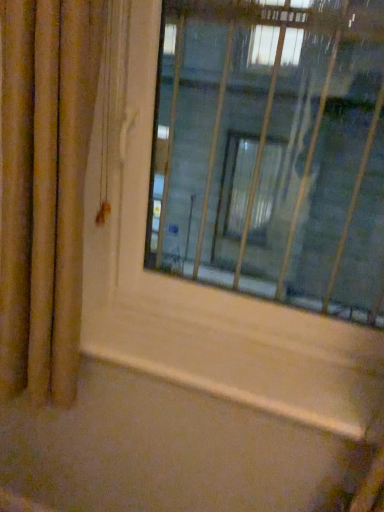
From the picture: Measure the distance between transparent glass window at center and camera.

transparent glass window at center and camera are 38.70 inches apart.

What do you see at coordinates (45, 189) in the screenshot? I see `gold textured curtain at left` at bounding box center [45, 189].

Image resolution: width=384 pixels, height=512 pixels. In order to click on transparent glass window at center in this screenshot , I will do `click(272, 151)`.

From the picture: Could you tell me if gold textured curtain at left is facing transparent glass window at center?

No, gold textured curtain at left is not oriented towards transparent glass window at center.

Is the position of gold textured curtain at left more distant than that of transparent glass window at center?

No, gold textured curtain at left is in front of transparent glass window at center.

Is gold textured curtain at left in contact with transparent glass window at center?

They are not placed beside each other.

Is gold textured curtain at left inside the boundaries of transparent glass window at center, or outside?

gold textured curtain at left is located beyond the bounds of transparent glass window at center.

Is transparent glass window at center to the left or to the right of wooden at lower center in the image?

Based on their positions, transparent glass window at center is located to the right of wooden at lower center.

Which of these two, transparent glass window at center or wooden at lower center, is wider?

With larger width is wooden at lower center.

Identify the location of window sill that is under the transparent glass window at center (from a real-world perspective). (234, 394).

Is transparent glass window at center positioned far away from wooden at lower center?

Actually, transparent glass window at center and wooden at lower center are a little close together.

In the scene shown: Is the position of transparent glass window at center more distant than that of gold textured curtain at left?

Yes, it is behind gold textured curtain at left.

How distant is transparent glass window at center from gold textured curtain at left?

They are 20.24 inches apart.

From the picture: Can you confirm if transparent glass window at center is shorter than gold textured curtain at left?

Indeed, transparent glass window at center has a lesser height compared to gold textured curtain at left.

Which is correct: transparent glass window at center is inside gold textured curtain at left, or outside of it?

transparent glass window at center cannot be found inside gold textured curtain at left.

From the image's perspective, does wooden at lower center appear lower than gold textured curtain at left?

Yes.

Considering the positions of points (361, 437) and (78, 159), is point (361, 437) closer to camera compared to point (78, 159)?

No, (361, 437) is behind (78, 159).

You are a GUI agent. You are given a task and a screenshot of the screen. Output one action in this format:
    pyautogui.click(x=<x>, y=<y>)
    Task: Click on the window sill directly beneath the gold textured curtain at left (from a real-world perspective)
    The height and width of the screenshot is (512, 384).
    Given the screenshot: What is the action you would take?
    pyautogui.click(x=234, y=394)

From a real-world perspective, who is located lower, wooden at lower center or gold textured curtain at left?

wooden at lower center is physically lower.

Can you confirm if wooden at lower center is positioned to the right of transparent glass window at center?

Incorrect, wooden at lower center is not on the right side of transparent glass window at center.

Looking at this image, how far apart are wooden at lower center and transparent glass window at center?

wooden at lower center is 23.08 inches away from transparent glass window at center.

From a real-world perspective, is wooden at lower center positioned over transparent glass window at center based on gravity?

Actually, wooden at lower center is physically below transparent glass window at center in the real world.

Which is in front, point (245, 390) or point (298, 252)?

The point (245, 390) is closer to the camera.

Is there a large distance between gold textured curtain at left and wooden at lower center?

No.

Considering the sizes of objects gold textured curtain at left and wooden at lower center in the image provided, who is bigger, gold textured curtain at left or wooden at lower center?

With larger size is gold textured curtain at left.

In the scene shown: Is gold textured curtain at left not within wooden at lower center?

That's correct, gold textured curtain at left is outside of wooden at lower center.

In the scene shown: Considering the sizes of gold textured curtain at left and wooden at lower center in the image, is gold textured curtain at left taller or shorter than wooden at lower center?

In the image, gold textured curtain at left appears to be taller than wooden at lower center.

Locate an element on the screen. window behind the gold textured curtain at left is located at coordinates (272, 151).

Identify the location of window sill on the left side of transparent glass window at center. This screenshot has width=384, height=512. (234, 394).

When comparing their distances from gold textured curtain at left, does transparent glass window at center or wooden at lower center seem closer?

The object closer to gold textured curtain at left is wooden at lower center.

Considering their positions, is gold textured curtain at left positioned further to transparent glass window at center than wooden at lower center?

wooden at lower center lies further to transparent glass window at center than the other object.

Estimate the real-world distances between objects in this image. Which object is closer to transparent glass window at center, wooden at lower center or gold textured curtain at left?

gold textured curtain at left is closer to transparent glass window at center.

Looking at this image, estimate the real-world distances between objects in this image. Which object is further from wooden at lower center, gold textured curtain at left or transparent glass window at center?

transparent glass window at center is positioned further to the anchor wooden at lower center.

Which object lies nearer to the anchor point gold textured curtain at left, wooden at lower center or transparent glass window at center?

The object closer to gold textured curtain at left is wooden at lower center.

Estimate the real-world distances between objects in this image. Which object is closer to wooden at lower center, transparent glass window at center or gold textured curtain at left?

gold textured curtain at left is closer to wooden at lower center.

This screenshot has width=384, height=512. Identify the location of window sill between gold textured curtain at left and transparent glass window at center in the horizontal direction. (234, 394).